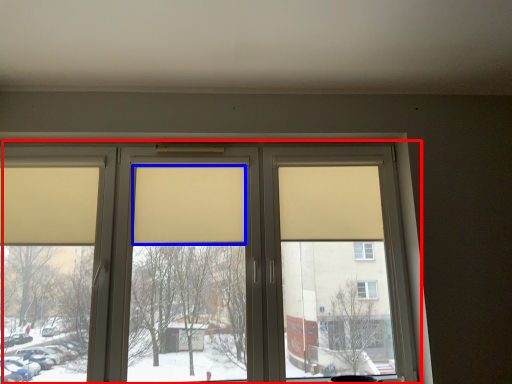
Question: Which of the following is the farthest to the observer, window (highlighted by a red box) or curtain (highlighted by a blue box)?

Choices:
 (A) window
 (B) curtain

Answer: (B)